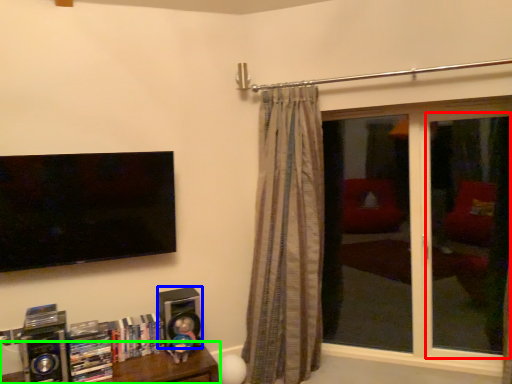
Question: Based on their relative distances, which object is farther from screen door (highlighted by a red box)? Choose from speaker (highlighted by a blue box) and furniture (highlighted by a green box).

Choices:
 (A) speaker
 (B) furniture

Answer: (B)